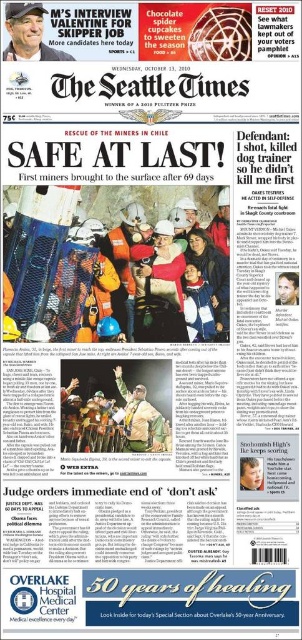
Can you confirm if camouflage fabric helmet at center is smaller than smooth skin face at center right?

Actually, camouflage fabric helmet at center might be larger than smooth skin face at center right.

Between camouflage fabric helmet at center and smooth skin face at center right, which one is positioned lower?

camouflage fabric helmet at center is lower down.

The height and width of the screenshot is (640, 302). I want to click on camouflage fabric helmet at center, so click(x=141, y=419).

The image size is (302, 640). I want to click on camouflage fabric helmet at center, so click(141, 419).

Between camouflage fabric helmet at center and matte black cap at upper left, which one is positioned lower?

camouflage fabric helmet at center is lower down.

Does camouflage fabric helmet at center have a lesser width compared to matte black cap at upper left?

Indeed, camouflage fabric helmet at center has a lesser width compared to matte black cap at upper left.

Between point (129, 440) and point (34, 49), which one is positioned behind?

Point (129, 440)

Locate an element on the screen. The image size is (302, 640). camouflage fabric helmet at center is located at coordinates (141, 419).

Who is positioned more to the right, hard hat helmet at center or matte black cap at upper left?

From the viewer's perspective, hard hat helmet at center appears more on the right side.

Who is higher up, hard hat helmet at center or matte black cap at upper left?

Positioned higher is matte black cap at upper left.

This screenshot has width=302, height=640. Identify the location of hard hat helmet at center. (116, 260).